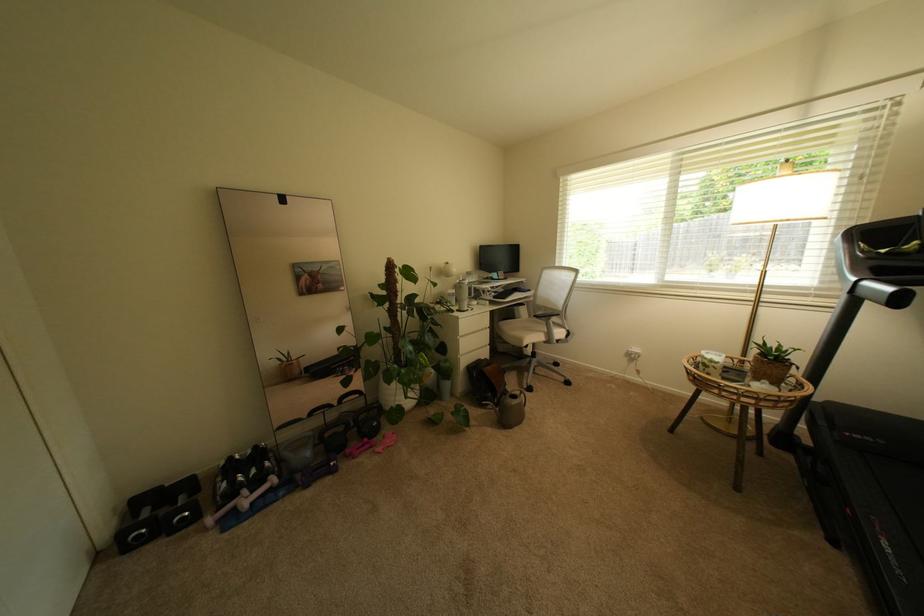
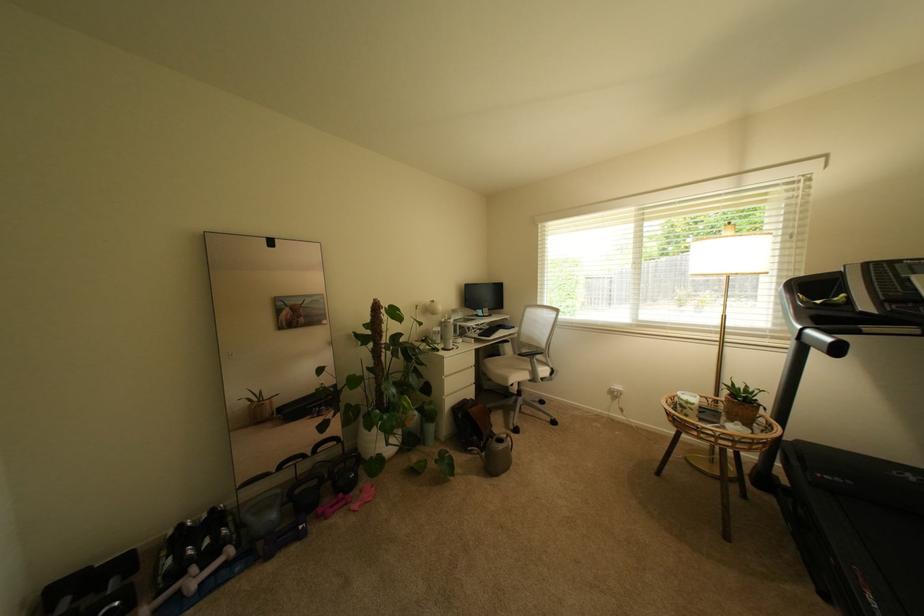
The point at (879,310) is marked in the first image. Where is the corresponding point in the second image?

(824, 355)